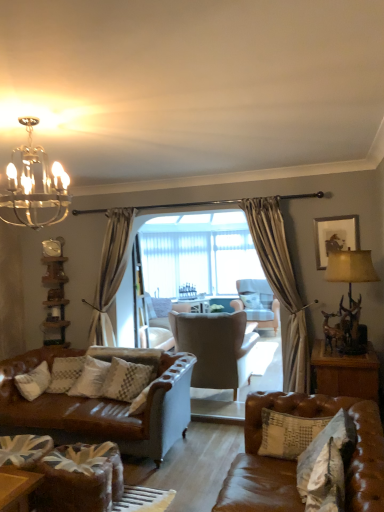
Question: Is the depth of suede wingback chair at center, the 2th chair positioned from the back, less than that of brown leather table at lower right?

Choices:
 (A) no
 (B) yes

Answer: (A)

Question: Considering the relative sizes of suede wingback chair at center, placed as the 1th chair when sorted from front to back, and brown leather table at lower right in the image provided, is suede wingback chair at center, placed as the 1th chair when sorted from front to back, thinner than brown leather table at lower right?

Choices:
 (A) yes
 (B) no

Answer: (B)

Question: Is suede wingback chair at center, placed as the 1th chair when sorted from front to back, positioned with its back to brown leather table at lower right?

Choices:
 (A) yes
 (B) no

Answer: (B)

Question: Can you confirm if suede wingback chair at center, the 2th chair when ordered from right to left, is positioned to the right of brown leather table at lower right?

Choices:
 (A) no
 (B) yes

Answer: (A)

Question: Is suede wingback chair at center, the 2th chair positioned from the back, not inside brown leather table at lower right?

Choices:
 (A) yes
 (B) no

Answer: (A)

Question: Relative to white textured pillow at lower right, the second pillow in the left-to-right sequence, is brown leather couch at lower right in front or behind?

Choices:
 (A) behind
 (B) front

Answer: (B)

Question: From the image's perspective, relative to white textured pillow at lower right, arranged as the first pillow when viewed from the front, is brown leather couch at lower right above or below?

Choices:
 (A) above
 (B) below

Answer: (B)

Question: In terms of height, does brown leather couch at lower right look taller or shorter compared to white textured pillow at lower right, the second pillow in the left-to-right sequence?

Choices:
 (A) short
 (B) tall

Answer: (B)

Question: Do you think brown leather couch at lower right is within white textured pillow at lower right, the 4th pillow positioned from the back, or outside of it?

Choices:
 (A) inside
 (B) outside

Answer: (B)

Question: Based on their sizes in the image, would you say metallic gold lamp at right is bigger or smaller than clear glass screen door at center?

Choices:
 (A) small
 (B) big

Answer: (B)

Question: Relative to clear glass screen door at center, is metallic gold lamp at right in front or behind?

Choices:
 (A) behind
 (B) front

Answer: (B)

Question: Choose the correct answer: Is metallic gold lamp at right inside clear glass screen door at center or outside it?

Choices:
 (A) outside
 (B) inside

Answer: (A)

Question: From the image's perspective, relative to clear glass screen door at center, is metallic gold lamp at right above or below?

Choices:
 (A) below
 (B) above

Answer: (B)

Question: Is point (347, 424) positioned closer to the camera than point (119, 358)?

Choices:
 (A) closer
 (B) farther

Answer: (A)

Question: In the image, is white textured pillow at lower right, the second pillow in the left-to-right sequence, on the left side or the right side of white textured pillow at center, which is the 1th pillow in left-to-right order?

Choices:
 (A) right
 (B) left

Answer: (A)